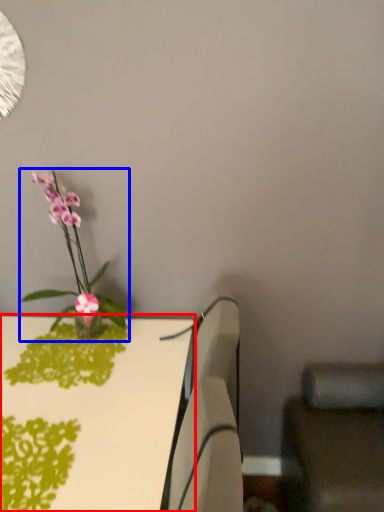
Question: Which of the following is the closest to the observer, table (highlighted by a red box) or houseplant (highlighted by a blue box)?

Choices:
 (A) table
 (B) houseplant

Answer: (A)